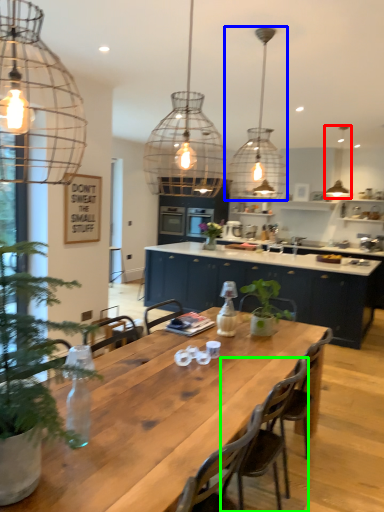
Question: Estimate the real-world distances between objects in this image. Which object is closer to lamp (highlighted by a red box), lamp (highlighted by a blue box) or chair (highlighted by a green box)?

Choices:
 (A) lamp
 (B) chair

Answer: (A)